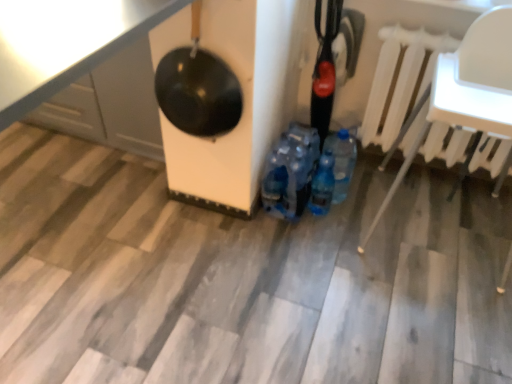
Question: Does blue translucent bottle at center come behind shiny black pan at upper left?

Choices:
 (A) yes
 (B) no

Answer: (A)

Question: Would you say blue translucent bottle at center is outside shiny black pan at upper left?

Choices:
 (A) yes
 (B) no

Answer: (A)

Question: Considering the relative sizes of blue translucent bottle at center and shiny black pan at upper left in the image provided, is blue translucent bottle at center taller than shiny black pan at upper left?

Choices:
 (A) yes
 (B) no

Answer: (B)

Question: Does blue translucent bottle at center have a greater width compared to shiny black pan at upper left?

Choices:
 (A) yes
 (B) no

Answer: (B)

Question: Considering the relative sizes of blue translucent bottle at center and shiny black pan at upper left in the image provided, is blue translucent bottle at center shorter than shiny black pan at upper left?

Choices:
 (A) yes
 (B) no

Answer: (A)

Question: Considering the positions of shiny black pan at upper left and black glossy wok at upper left in the image, is shiny black pan at upper left taller or shorter than black glossy wok at upper left?

Choices:
 (A) tall
 (B) short

Answer: (A)

Question: Based on their positions, is shiny black pan at upper left located to the left or right of black glossy wok at upper left?

Choices:
 (A) right
 (B) left

Answer: (B)

Question: Is point (128, 31) positioned closer to the camera than point (195, 124)?

Choices:
 (A) farther
 (B) closer

Answer: (B)

Question: From the image's perspective, is shiny black pan at upper left positioned above or below black glossy wok at upper left?

Choices:
 (A) above
 (B) below

Answer: (A)

Question: Is shiny black pan at upper left taller or shorter than white plastic radiator at upper right?

Choices:
 (A) short
 (B) tall

Answer: (B)

Question: Choose the correct answer: Is shiny black pan at upper left inside white plastic radiator at upper right or outside it?

Choices:
 (A) inside
 (B) outside

Answer: (B)

Question: Is point (11, 8) positioned closer to the camera than point (407, 132)?

Choices:
 (A) farther
 (B) closer

Answer: (B)

Question: Relative to white plastic radiator at upper right, is shiny black pan at upper left in front or behind?

Choices:
 (A) front
 (B) behind

Answer: (A)

Question: Is shiny black pan at upper left in front of or behind blue translucent bottle at center in the image?

Choices:
 (A) front
 (B) behind

Answer: (A)

Question: From the image's perspective, relative to blue translucent bottle at center, is shiny black pan at upper left above or below?

Choices:
 (A) above
 (B) below

Answer: (A)